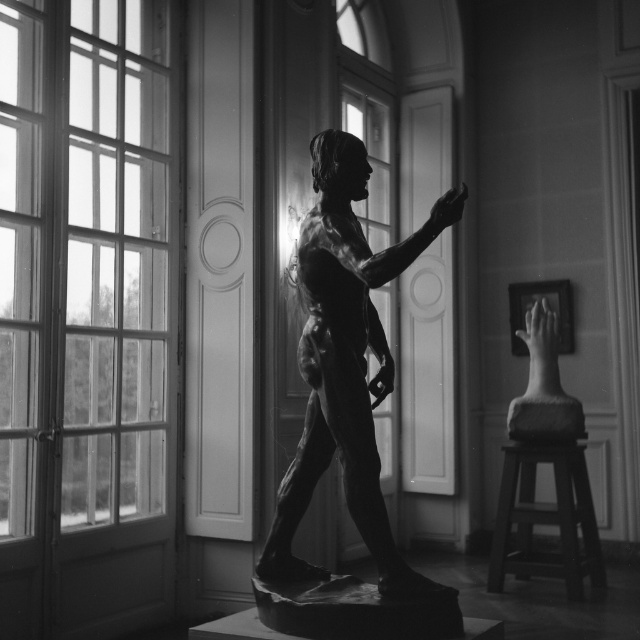
Can you confirm if clear glass window at left is positioned to the left of polished bronze statue at center?

Yes, clear glass window at left is to the left of polished bronze statue at center.

Who is more distant from viewer, (x=38, y=392) or (x=330, y=131)?

Point (x=38, y=392)

The width and height of the screenshot is (640, 640). Describe the element at coordinates (84, 259) in the screenshot. I see `clear glass window at left` at that location.

The image size is (640, 640). I want to click on clear glass window at left, so click(x=84, y=259).

Looking at this image, between polished bronze statue at center and smooth stone hand at right, which one appears on the right side from the viewer's perspective?

smooth stone hand at right

Can you confirm if polished bronze statue at center is shorter than smooth stone hand at right?

Incorrect, polished bronze statue at center's height does not fall short of smooth stone hand at right's.

Does point (326, 326) come in front of point (573, 429)?

Yes.

Where is `polished bronze statue at center`? The image size is (640, 640). polished bronze statue at center is located at coordinates (348, 374).

Between clear glass window at left and smooth stone hand at right, which one is positioned higher?

clear glass window at left

Does point (115, 328) come behind point (522, 404)?

That is False.

What are the coordinates of `clear glass window at left` in the screenshot? It's located at (84, 259).